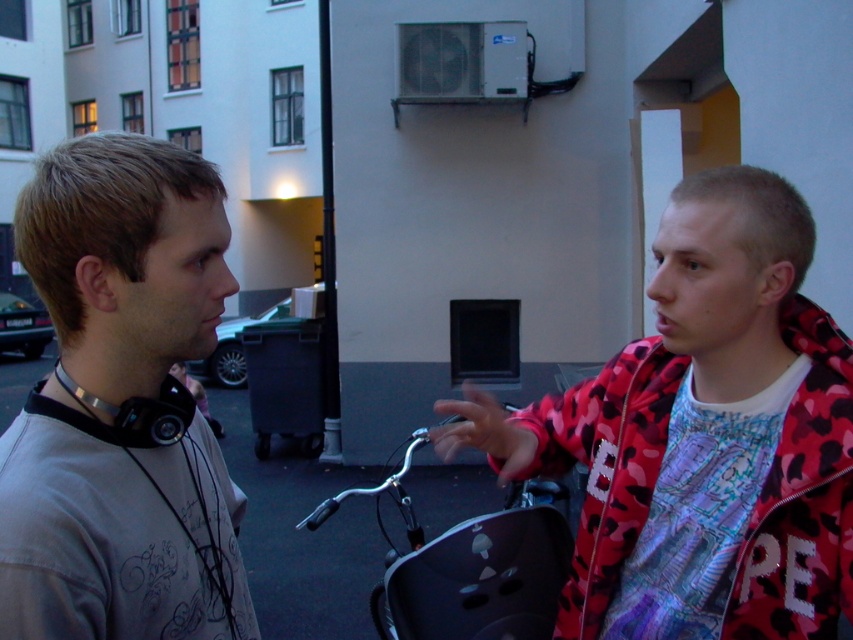
You are standing in front of the building with two points marked on it. The points are labeled as point 1 and point 2. You want to know which point is closer to you. The points are located at coordinates point 1 at (10,616) and point 2 at (587,612). Which point is closer to you?

Point 1 at (10,616) is closer to you than point 2 at (587,612).